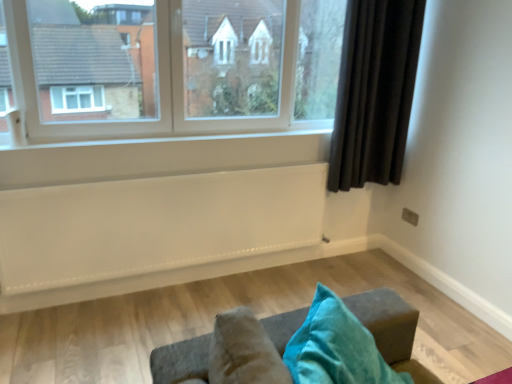
Question: Is white painted wood at center looking in the opposite direction of dark fabric curtain at right?

Choices:
 (A) yes
 (B) no

Answer: (B)

Question: From a real-world perspective, is white painted wood at center below dark fabric curtain at right?

Choices:
 (A) yes
 (B) no

Answer: (A)

Question: Is white painted wood at center next to dark fabric curtain at right and touching it?

Choices:
 (A) no
 (B) yes

Answer: (A)

Question: Can you confirm if white painted wood at center is shorter than dark fabric curtain at right?

Choices:
 (A) yes
 (B) no

Answer: (A)

Question: Is white painted wood at center wider than dark fabric curtain at right?

Choices:
 (A) yes
 (B) no

Answer: (A)

Question: Based on their sizes in the image, would you say clear glass window at upper center is bigger or smaller than white painted wood at center?

Choices:
 (A) small
 (B) big

Answer: (B)

Question: Relative to white painted wood at center, is clear glass window at upper center in front or behind?

Choices:
 (A) behind
 (B) front

Answer: (B)

Question: Looking at their shapes, would you say clear glass window at upper center is wider or thinner than white painted wood at center?

Choices:
 (A) wide
 (B) thin

Answer: (B)

Question: From the image's perspective, relative to white painted wood at center, is clear glass window at upper center above or below?

Choices:
 (A) below
 (B) above

Answer: (B)

Question: Is dark fabric curtain at right taller or shorter than white painted wood at center?

Choices:
 (A) short
 (B) tall

Answer: (B)

Question: In terms of width, does dark fabric curtain at right look wider or thinner when compared to white painted wood at center?

Choices:
 (A) wide
 (B) thin

Answer: (B)

Question: Relative to white painted wood at center, is dark fabric curtain at right in front or behind?

Choices:
 (A) front
 (B) behind

Answer: (B)

Question: From the image's perspective, relative to white painted wood at center, is dark fabric curtain at right above or below?

Choices:
 (A) above
 (B) below

Answer: (A)

Question: Considering the positions of dark fabric curtain at right and white textured radiator at lower center in the image, is dark fabric curtain at right wider or thinner than white textured radiator at lower center?

Choices:
 (A) thin
 (B) wide

Answer: (B)

Question: Considering the positions of dark fabric curtain at right and white textured radiator at lower center in the image, is dark fabric curtain at right bigger or smaller than white textured radiator at lower center?

Choices:
 (A) big
 (B) small

Answer: (B)